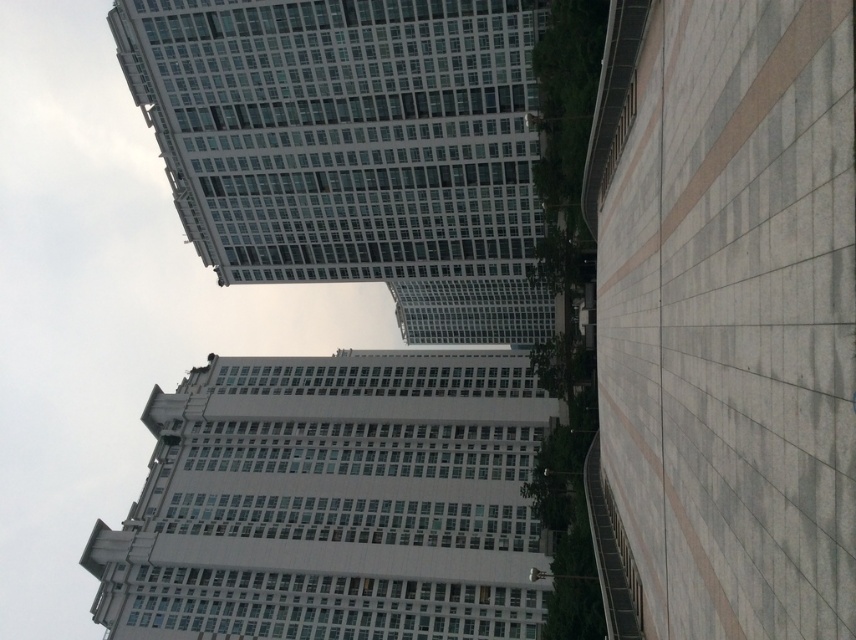
Question: Observing the image, what is the correct spatial positioning of white smooth building at center in reference to white glass building at upper center?

Choices:
 (A) below
 (B) above

Answer: (A)

Question: Considering the relative positions of white smooth building at center and white glass building at upper center in the image provided, where is white smooth building at center located with respect to white glass building at upper center?

Choices:
 (A) left
 (B) right

Answer: (A)

Question: Which of the following is the closest to the observer?

Choices:
 (A) (195, 4)
 (B) (229, 545)

Answer: (A)

Question: Which object is positioned closest to the white smooth building at center?

Choices:
 (A) white smooth sidewalk at right
 (B) white glass building at upper center

Answer: (B)

Question: Among these objects, which one is farthest from the camera?

Choices:
 (A) white glass building at upper center
 (B) white smooth building at center
 (C) white smooth sidewalk at right

Answer: (A)

Question: Observing the image, what is the correct spatial positioning of white smooth sidewalk at right in reference to white glass building at upper center?

Choices:
 (A) below
 (B) above

Answer: (A)